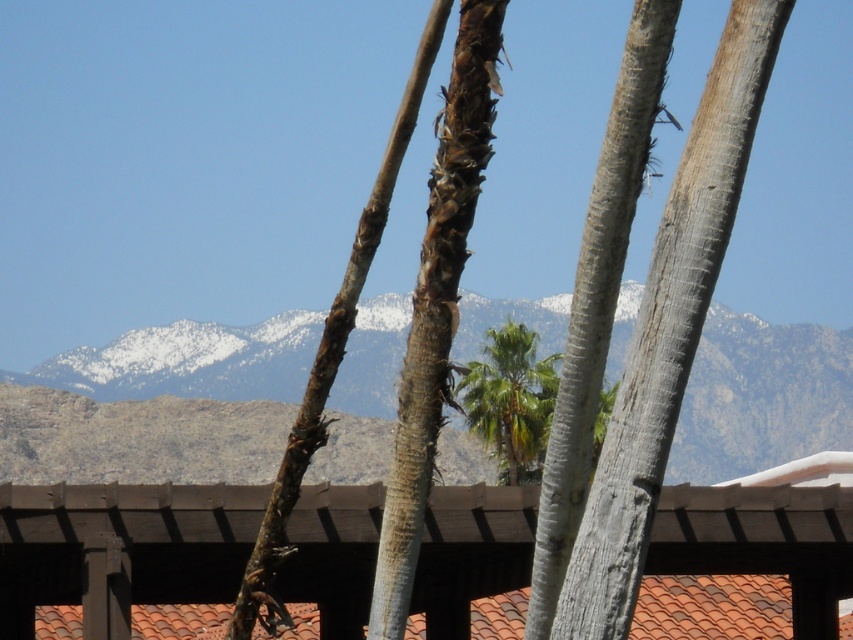
Does brown wood pergola at center come behind green leafy palm tree at center?

That is False.

Is point (509, 625) in front of point (465, 420)?

That is True.

The width and height of the screenshot is (853, 640). I want to click on brown wood pergola at center, so click(119, 548).

Between snowy rock mountain range at center and green leafy palm tree at center, which one has less height?

green leafy palm tree at center

Who is positioned more to the left, snowy rock mountain range at center or green leafy palm tree at center?

Positioned to the left is snowy rock mountain range at center.

Which is behind, point (131, 360) or point (527, 461)?

The point (131, 360) is behind.

Locate an element on the screen. This screenshot has height=640, width=853. snowy rock mountain range at center is located at coordinates (761, 396).

Does brown wood pergola at center appear over snowy rock mountain range at center?

Answer: No, brown wood pergola at center is not above snowy rock mountain range at center.

Based on the photo, is brown wood pergola at center bigger than snowy rock mountain range at center?

Incorrect, brown wood pergola at center is not larger than snowy rock mountain range at center.

Describe the element at coordinates (119, 548) in the screenshot. I see `brown wood pergola at center` at that location.

In order to click on brown wood pergola at center in this screenshot , I will do `click(119, 548)`.